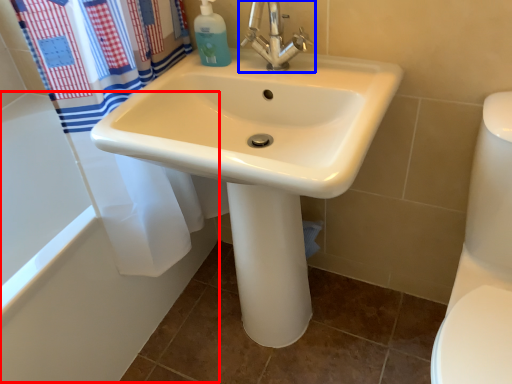
Question: Which object appears farthest to the camera in this image, bath (highlighted by a red box) or tap (highlighted by a blue box)?

Choices:
 (A) bath
 (B) tap

Answer: (A)